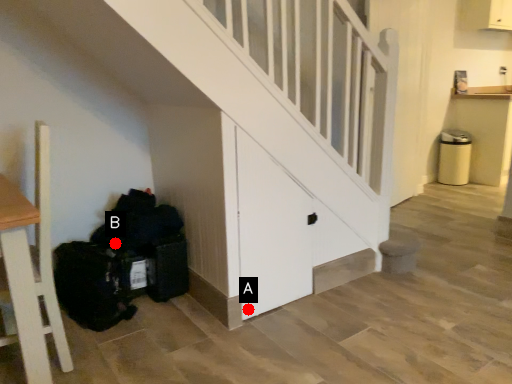
Question: Two points are circled on the image, labeled by A and B beside each circle. Which point is further to the camera?

Choices:
 (A) A is further
 (B) B is further

Answer: (B)